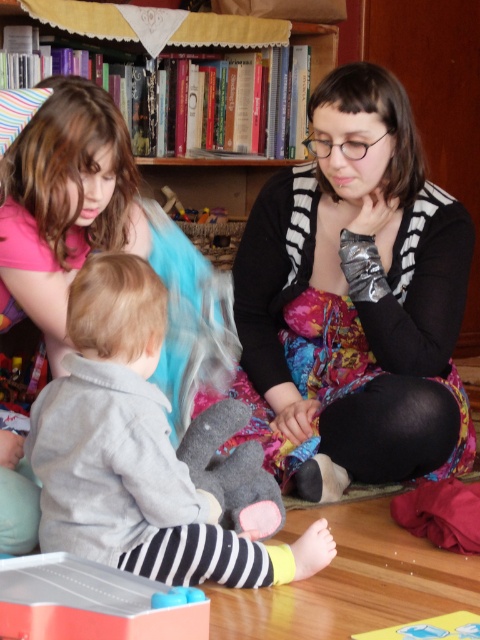
Question: Can you confirm if black and white striped sweater at center is smaller than smooth plastic toy at lower center?

Choices:
 (A) yes
 (B) no

Answer: (B)

Question: Which point appears closest to the camera in this image?

Choices:
 (A) (145, 170)
 (B) (111, 448)
 (C) (289, 248)

Answer: (B)

Question: Among these points, which one is nearest to the camera?

Choices:
 (A) coord(166,605)
 (B) coord(54,572)
 (C) coord(467,212)
 (D) coord(188,48)

Answer: (A)

Question: Is black and white striped sweater at center further to the viewer compared to translucent plastic toy at lower left?

Choices:
 (A) yes
 (B) no

Answer: (A)

Question: Is black and white striped sweater at center below smooth plastic toy at lower center?

Choices:
 (A) no
 (B) yes

Answer: (A)

Question: Estimate the real-world distances between objects in this image. Which object is farther from the translucent plastic toy at lower left?

Choices:
 (A) smooth plastic toy at lower center
 (B) black and white striped sweater at center
 (C) wooden bookshelf at upper center

Answer: (C)